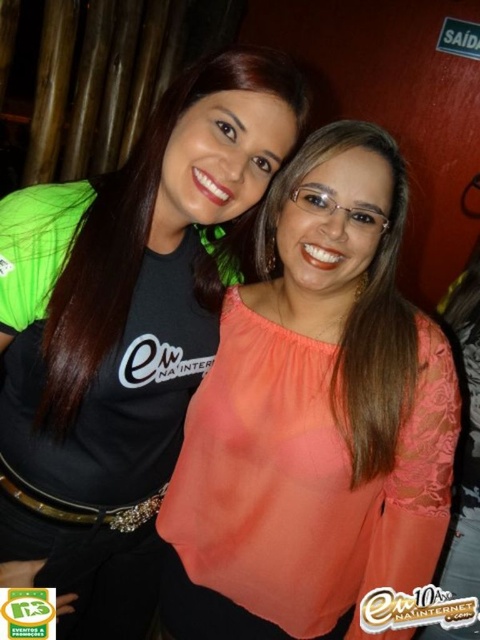
Between point (184, 556) and point (192, 188), which one is positioned behind?

The point (184, 556) is more distant.

Who is higher up, coral lace blouse at center or matte black shirt at left?

Positioned higher is coral lace blouse at center.

Is point (229, 372) less distant than point (159, 353)?

No, it is not.

This screenshot has height=640, width=480. In order to click on coral lace blouse at center in this screenshot , I will do `click(313, 416)`.

Does matte black shirt at left have a smaller size compared to matte coral blouse at center?

No.

Can you confirm if matte black shirt at left is positioned above matte coral blouse at center?

No, matte black shirt at left is not above matte coral blouse at center.

The image size is (480, 640). What do you see at coordinates (124, 333) in the screenshot?
I see `matte black shirt at left` at bounding box center [124, 333].

The width and height of the screenshot is (480, 640). What are the coordinates of `matte black shirt at left` in the screenshot? It's located at (124, 333).

Does coral lace blouse at center have a lesser height compared to matte coral blouse at center?

Incorrect, coral lace blouse at center's height does not fall short of matte coral blouse at center's.

Is coral lace blouse at center taller than matte coral blouse at center?

Correct, coral lace blouse at center is much taller as matte coral blouse at center.

Identify the location of coral lace blouse at center. (313, 416).

Find the location of `coral lace blouse at center`. coral lace blouse at center is located at coordinates coord(313,416).